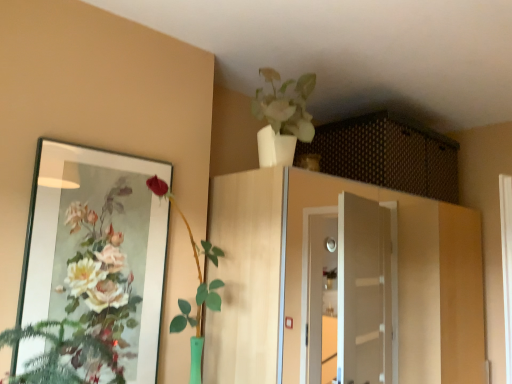
Question: From a real-world perspective, is wooden cabinet at center, acting as the 2th cabinetry starting from the top, under brown woven basket at upper center, the 2th cabinetry in the bottom-to-top sequence?

Choices:
 (A) yes
 (B) no

Answer: (A)

Question: Is wooden cabinet at center, positioned as the 1th cabinetry in bottom-to-top order, not within brown woven basket at upper center, acting as the first cabinetry starting from the top?

Choices:
 (A) no
 (B) yes

Answer: (B)

Question: Is the position of wooden cabinet at center, acting as the 2th cabinetry starting from the top, less distant than that of brown woven basket at upper center, the 2th cabinetry in the bottom-to-top sequence?

Choices:
 (A) yes
 (B) no

Answer: (A)

Question: Does wooden cabinet at center, acting as the 2th cabinetry starting from the top, have a larger size compared to brown woven basket at upper center, the 2th cabinetry in the bottom-to-top sequence?

Choices:
 (A) yes
 (B) no

Answer: (A)

Question: Considering the relative sizes of wooden cabinet at center, positioned as the 1th cabinetry in bottom-to-top order, and brown woven basket at upper center, acting as the first cabinetry starting from the top, in the image provided, is wooden cabinet at center, positioned as the 1th cabinetry in bottom-to-top order, smaller than brown woven basket at upper center, acting as the first cabinetry starting from the top,?

Choices:
 (A) yes
 (B) no

Answer: (B)

Question: Is wooden cabinet at center, acting as the 2th cabinetry starting from the top, aimed at brown woven basket at upper center, acting as the first cabinetry starting from the top?

Choices:
 (A) no
 (B) yes

Answer: (A)

Question: Does matte glass mirror at left have a greater width compared to wooden cabinet at center, positioned as the 1th cabinetry in bottom-to-top order?

Choices:
 (A) yes
 (B) no

Answer: (B)

Question: From the image's perspective, does matte glass mirror at left appear lower than wooden cabinet at center, positioned as the 1th cabinetry in bottom-to-top order?

Choices:
 (A) no
 (B) yes

Answer: (A)

Question: Is matte glass mirror at left touching wooden cabinet at center, positioned as the 1th cabinetry in bottom-to-top order?

Choices:
 (A) no
 (B) yes

Answer: (A)

Question: Considering the relative sizes of matte glass mirror at left and wooden cabinet at center, acting as the 2th cabinetry starting from the top, in the image provided, is matte glass mirror at left shorter than wooden cabinet at center, acting as the 2th cabinetry starting from the top,?

Choices:
 (A) no
 (B) yes

Answer: (B)

Question: From the image's perspective, does matte glass mirror at left appear higher than wooden cabinet at center, positioned as the 1th cabinetry in bottom-to-top order?

Choices:
 (A) no
 (B) yes

Answer: (B)

Question: Does matte glass mirror at left appear on the right side of wooden cabinet at center, acting as the 2th cabinetry starting from the top?

Choices:
 (A) yes
 (B) no

Answer: (B)

Question: Is the position of white glossy vase at upper center, which is the 2th houseplant in left-to-right order, less distant than that of brown woven basket at upper center, acting as the first cabinetry starting from the top?

Choices:
 (A) yes
 (B) no

Answer: (A)